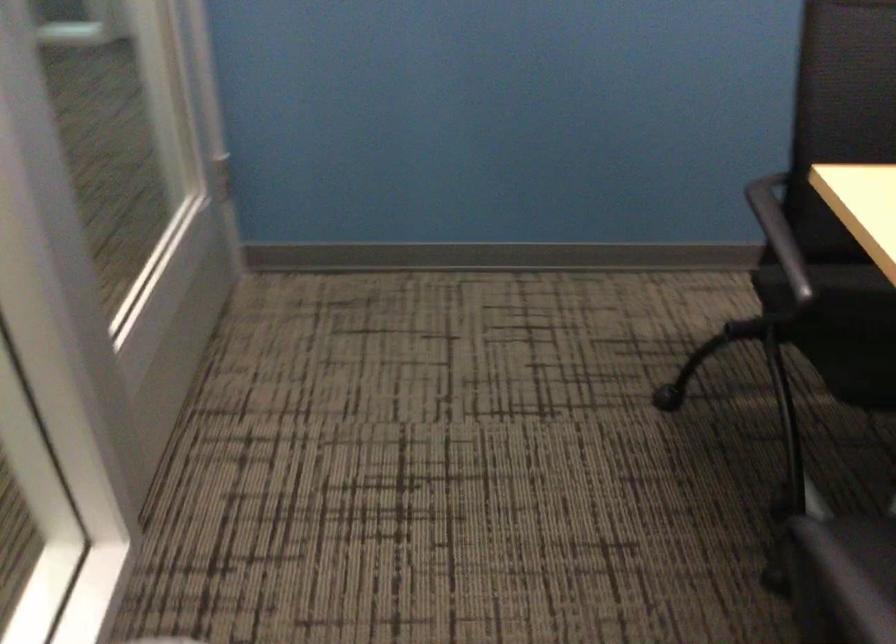
Where is `chair sitting surface`? This screenshot has height=644, width=896. chair sitting surface is located at coordinates (840, 327).